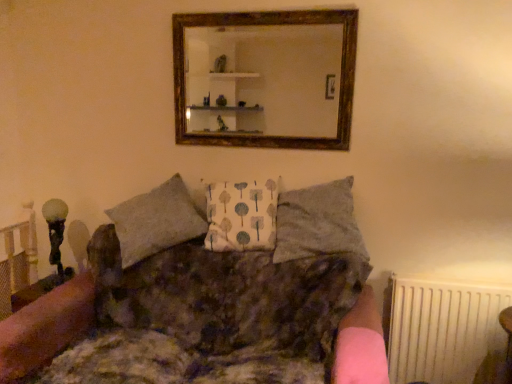
Question: Does textured gray pillow at center, which is the 1th pillow from right to left, appear on the left side of textured brown fabric couch at center?

Choices:
 (A) no
 (B) yes

Answer: (A)

Question: Can you confirm if textured gray pillow at center, which is the 1th pillow from right to left, is wider than textured brown fabric couch at center?

Choices:
 (A) yes
 (B) no

Answer: (B)

Question: Is textured gray pillow at center, which is counted as the second pillow, starting from the left, far away from textured brown fabric couch at center?

Choices:
 (A) no
 (B) yes

Answer: (A)

Question: Can you confirm if textured gray pillow at center, which is the 1th pillow from right to left, is thinner than textured brown fabric couch at center?

Choices:
 (A) no
 (B) yes

Answer: (B)

Question: From the image's perspective, does textured gray pillow at center, which is the 1th pillow from right to left, appear higher than textured brown fabric couch at center?

Choices:
 (A) yes
 (B) no

Answer: (A)

Question: Is textured brown fabric couch at center situated inside white fabric pillow at center, placed as the first pillow when sorted from left to right, or outside?

Choices:
 (A) inside
 (B) outside

Answer: (B)

Question: From a real-world perspective, is textured brown fabric couch at center physically located above or below white fabric pillow at center, placed as the first pillow when sorted from left to right?

Choices:
 (A) above
 (B) below

Answer: (B)

Question: Looking at their shapes, would you say textured brown fabric couch at center is wider or thinner than white fabric pillow at center, placed as the first pillow when sorted from left to right?

Choices:
 (A) wide
 (B) thin

Answer: (A)

Question: Based on their positions, is textured brown fabric couch at center located to the left or right of white fabric pillow at center, placed as the first pillow when sorted from left to right?

Choices:
 (A) left
 (B) right

Answer: (A)

Question: Is point (328, 69) closer or farther from the camera than point (402, 304)?

Choices:
 (A) closer
 (B) farther

Answer: (A)

Question: From the image's perspective, relative to white plastic radiator at lower right, is wooden frame mirror at upper center above or below?

Choices:
 (A) above
 (B) below

Answer: (A)

Question: In terms of size, does wooden frame mirror at upper center appear bigger or smaller than white plastic radiator at lower right?

Choices:
 (A) big
 (B) small

Answer: (B)

Question: Relative to white plastic radiator at lower right, is wooden frame mirror at upper center in front or behind?

Choices:
 (A) front
 (B) behind

Answer: (B)

Question: From their relative heights in the image, would you say textured gray pillow at center, which is the 1th pillow from right to left, is taller or shorter than textured brown fabric couch at center?

Choices:
 (A) tall
 (B) short

Answer: (B)

Question: Considering their positions, is textured gray pillow at center, which is counted as the second pillow, starting from the left, located in front of or behind textured brown fabric couch at center?

Choices:
 (A) front
 (B) behind

Answer: (B)